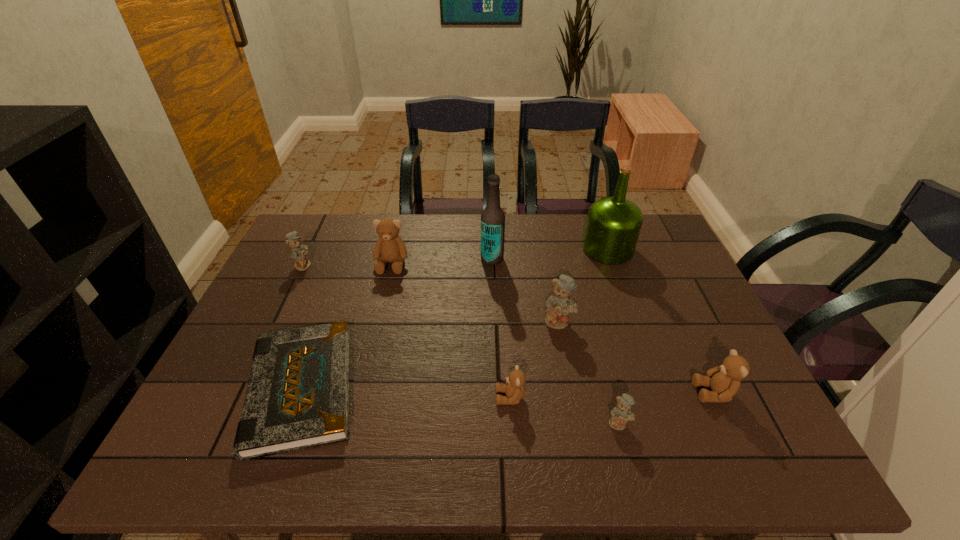
The width and height of the screenshot is (960, 540). Identify the location of free area in between the second blue teddy bear from left to right and the eighth object from left to right. (584, 285).

At what (x,y) coordinates should I click in order to perform the action: click on free space that is in between the leftmost brown teddy bear and the second blue teddy bear from right to left. Please return your answer as a coordinate pair (x, y). Image resolution: width=960 pixels, height=540 pixels. Looking at the image, I should click on (475, 293).

Find the location of a particular element. The height and width of the screenshot is (540, 960). vacant space that's between the nearest teddy bear and the beer bottle is located at coordinates (556, 341).

Locate an element on the screen. This screenshot has width=960, height=540. free space between the beer bottle and the second blue teddy bear from right to left is located at coordinates (525, 290).

Find the location of `free spot between the fourth teddy bear from right to left and the leftmost blue teddy bear`. free spot between the fourth teddy bear from right to left and the leftmost blue teddy bear is located at coordinates pos(407,331).

Locate an element on the screen. This screenshot has height=540, width=960. vacant area that lies between the farthest blue teddy bear and the smallest brown teddy bear is located at coordinates (407, 331).

Where is `vacant space that is in between the smallest brown teddy bear and the beer bottle`? This screenshot has width=960, height=540. vacant space that is in between the smallest brown teddy bear and the beer bottle is located at coordinates (501, 328).

The width and height of the screenshot is (960, 540). What are the coordinates of `object that stands as the third closest to the beer bottle` in the screenshot? It's located at (613, 225).

The width and height of the screenshot is (960, 540). I want to click on object identified as the sixth closest to the fifth teddy bear from right to left, so click(613, 225).

At what (x,y) coordinates should I click in order to perform the action: click on teddy bear that is the second nearest to the fourth teddy bear from left to right. Please return your answer as a coordinate pair (x, y). The width and height of the screenshot is (960, 540). Looking at the image, I should click on (621, 414).